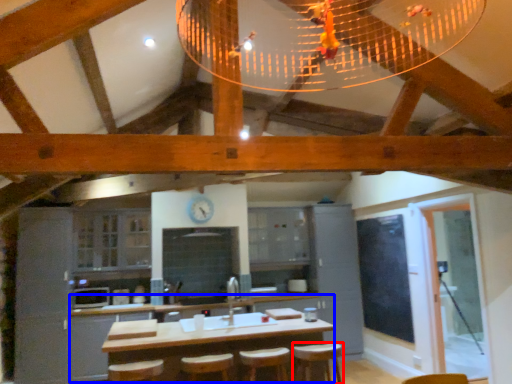
Question: Which object appears farthest to the camera in this image, bar stool (highlighted by a red box) or counter (highlighted by a blue box)?

Choices:
 (A) bar stool
 (B) counter

Answer: (A)